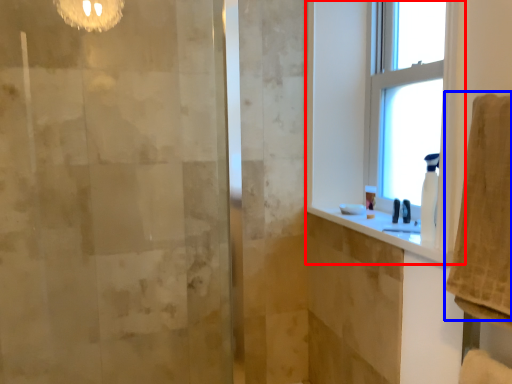
Question: Among these objects, which one is nearest to the camera, window (highlighted by a red box) or bath towel (highlighted by a blue box)?

Choices:
 (A) window
 (B) bath towel

Answer: (B)